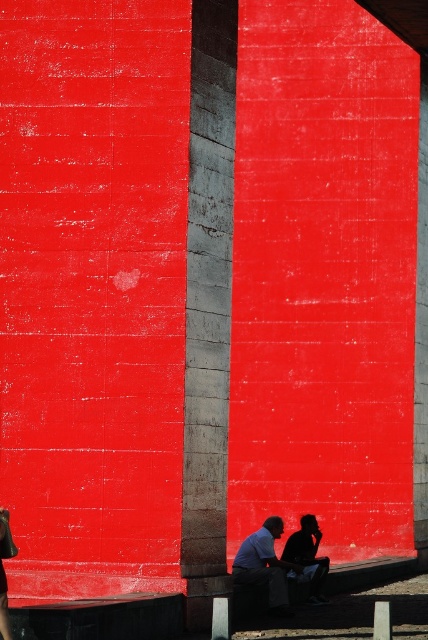
Question: Considering the real-world distances, which object is farthest from the silhouette fabric at lower right?

Choices:
 (A) concrete pillar at center
 (B) matte blue shirt at lower center

Answer: (A)

Question: Does concrete pillar at center have a larger size compared to silhouette fabric at lower right?

Choices:
 (A) no
 (B) yes

Answer: (B)

Question: Which of the following is the closest to the observer?

Choices:
 (A) concrete pillar at center
 (B) matte blue shirt at lower center

Answer: (A)

Question: Is concrete pillar at center thinner than matte blue shirt at lower center?

Choices:
 (A) no
 (B) yes

Answer: (A)

Question: Based on their relative distances, which object is farther from the matte blue shirt at lower center?

Choices:
 (A) concrete pillar at center
 (B) silhouette fabric at lower right

Answer: (A)

Question: Is matte blue shirt at lower center thinner than silhouette fabric at lower right?

Choices:
 (A) yes
 (B) no

Answer: (A)